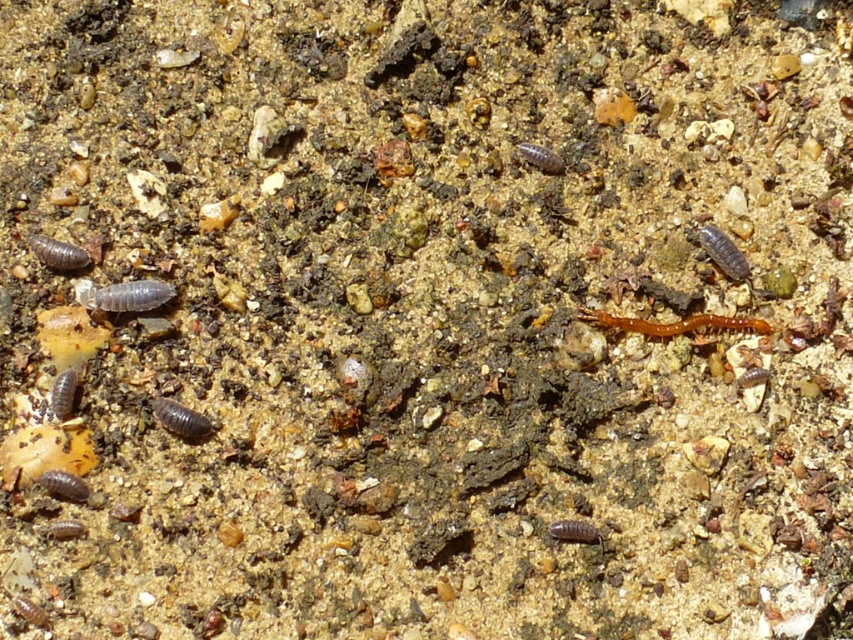
Looking at this image, between matte gray worm at left and brown matte worm at center, which one has more height?

matte gray worm at left is taller.

Is matte gray worm at left closer to the viewer compared to brown matte worm at center?

No, matte gray worm at left is behind brown matte worm at center.

Does point (74, 268) lie in front of point (587, 538)?

No, it is behind (587, 538).

Where is `matte gray worm at left`? Image resolution: width=853 pixels, height=640 pixels. matte gray worm at left is located at coordinates (57, 253).

Does point (65, 372) lie in front of point (585, 536)?

Yes, point (65, 372) is in front of point (585, 536).

Does point (68, 403) lie in front of point (575, 538)?

Yes, it is.

You are a GUI agent. You are given a task and a screenshot of the screen. Output one action in this format:
    pyautogui.click(x=<x>, y=<y>)
    Task: Click on the smooth brown worm at lower left
    
    Given the screenshot: What is the action you would take?
    pyautogui.click(x=62, y=394)

Between orange matte centipede at center and shiny black worm at center, which one appears on the left side from the viewer's perspective?

From the viewer's perspective, shiny black worm at center appears more on the left side.

Which is below, orange matte centipede at center or shiny black worm at center?

shiny black worm at center is below.

Looking at this image, who is more forward, (631, 323) or (207, 417)?

Positioned in front is point (207, 417).

At what (x,y) coordinates should I click in order to perform the action: click on orange matte centipede at center. Please return your answer as a coordinate pair (x, y). The height and width of the screenshot is (640, 853). Looking at the image, I should click on (672, 323).